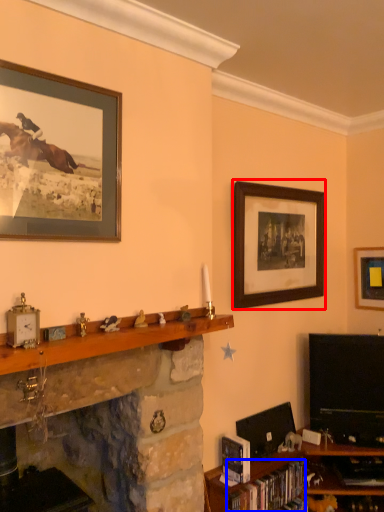
Question: Which of the following is the farthest to the observer, picture frame (highlighted by a red box) or book (highlighted by a blue box)?

Choices:
 (A) picture frame
 (B) book

Answer: (A)